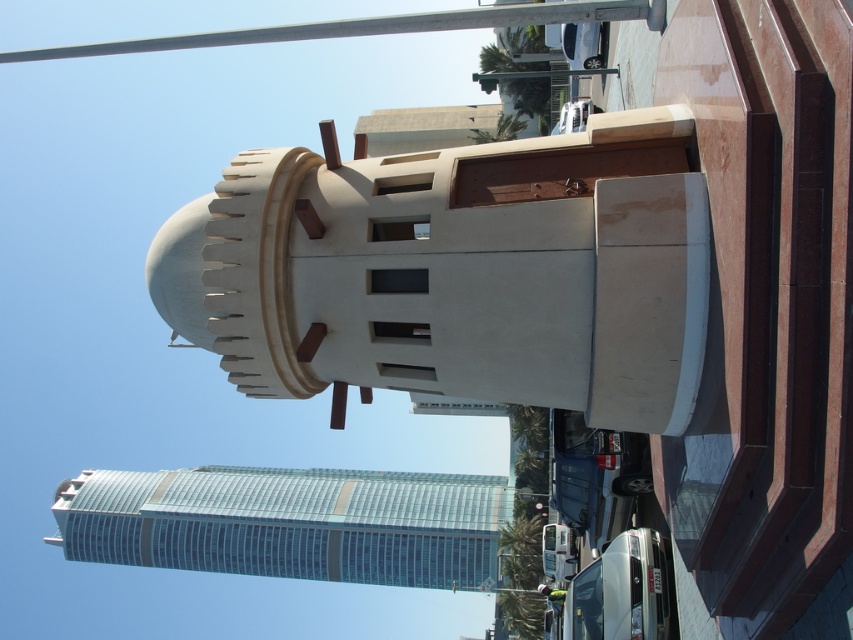
In the scene shown: You are standing in front of the modern skyscraper and want to determine which of the two points, point (299, 26) or point (582, 632), is closer to you. Based on the scene, which point is nearer?

Point (299, 26) is further to the viewer than point (582, 632). Therefore, point (582, 632) is closer to you.

You are a pedestrian standing on the sidewalk and see the metallic pole at upper center and the white glossy bus at lower center. Which object is higher up in the image?

The metallic pole at upper center is higher up in the image because it is located above the white glossy bus at lower center.